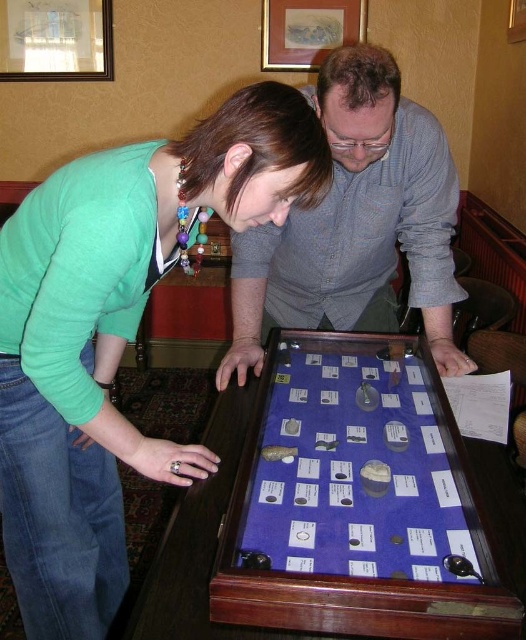
You are a visitor at a museum and see the blue velvet display case at center and the blue velvet game at center. Which one is positioned to the left?

The blue velvet display case at center is to the left of the blue velvet game at center.

You are trying to determine if the green matte sweater at center can completely cover the blue velvet game at center when placed over it. Based on their sizes, what do you think?

The green matte sweater at center might be wider than blue velvet game at center, so it could potentially cover it depending on the exact dimensions.